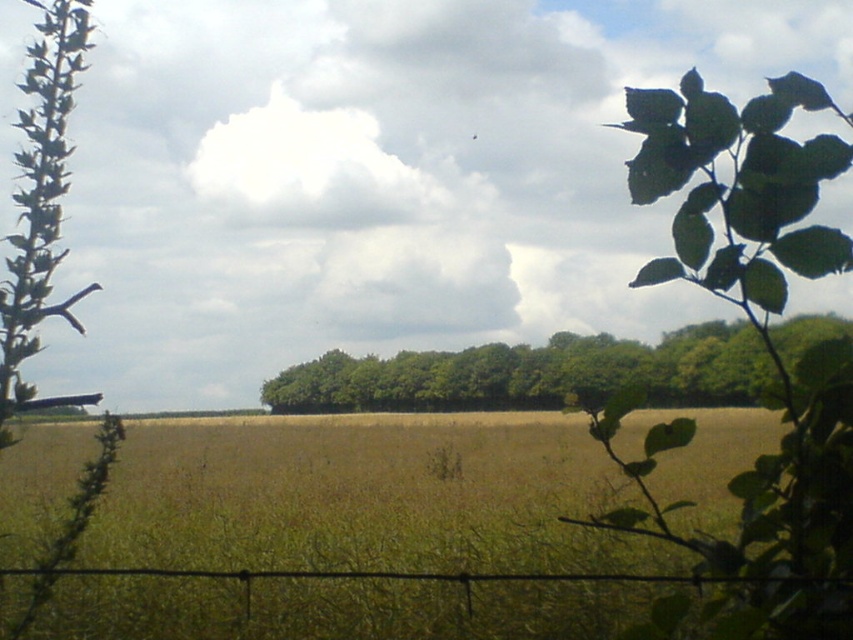
Does green leafy trees at center lie behind black wire fence at lower center?

Yes, it is behind black wire fence at lower center.

Where is `green leafy trees at center`? This screenshot has width=853, height=640. green leafy trees at center is located at coordinates (532, 372).

Can you confirm if green leafy trees at center is thinner than green fuzzy plant at lower left?

Incorrect, green leafy trees at center's width is not less than green fuzzy plant at lower left's.

Is point (693, 358) in front of point (35, 595)?

No.

The image size is (853, 640). What do you see at coordinates (532, 372) in the screenshot?
I see `green leafy trees at center` at bounding box center [532, 372].

The image size is (853, 640). I want to click on green leafy trees at center, so click(532, 372).

Consider the image. Does black wire fence at lower center appear over green fuzzy plant at lower left?

Indeed, black wire fence at lower center is positioned over green fuzzy plant at lower left.

Does black wire fence at lower center appear on the right side of green fuzzy plant at lower left?

Indeed, black wire fence at lower center is positioned on the right side of green fuzzy plant at lower left.

Who is more forward, (x=210, y=573) or (x=47, y=580)?

Positioned in front is point (x=210, y=573).

Locate an element on the screen. The image size is (853, 640). black wire fence at lower center is located at coordinates (442, 577).